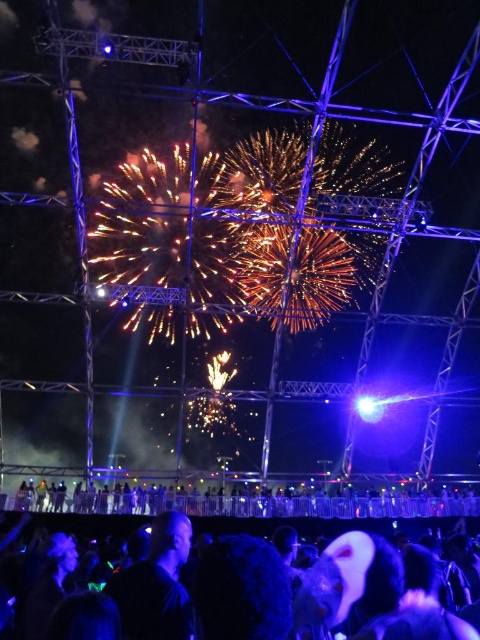
Question: Does black matte crowd at lower center appear on the left side of black fabric crowd at lower center?

Choices:
 (A) yes
 (B) no

Answer: (B)

Question: Which point appears farthest from the camera in this image?

Choices:
 (A) (358, 413)
 (B) (78, 508)
 (C) (192, 540)

Answer: (A)

Question: Considering the real-world distances, which object is farthest from the black fabric crowd at lower center?

Choices:
 (A) black matte crowd at lower center
 (B) bright white spotlight at upper center

Answer: (B)

Question: Estimate the real-world distances between objects in this image. Which object is farther from the black fabric crowd at lower center?

Choices:
 (A) black matte crowd at lower center
 (B) bright white spotlight at upper center

Answer: (B)

Question: Can you confirm if black matte crowd at lower center is thinner than bright white spotlight at upper center?

Choices:
 (A) no
 (B) yes

Answer: (A)

Question: Is black matte crowd at lower center smaller than black fabric crowd at lower center?

Choices:
 (A) yes
 (B) no

Answer: (A)